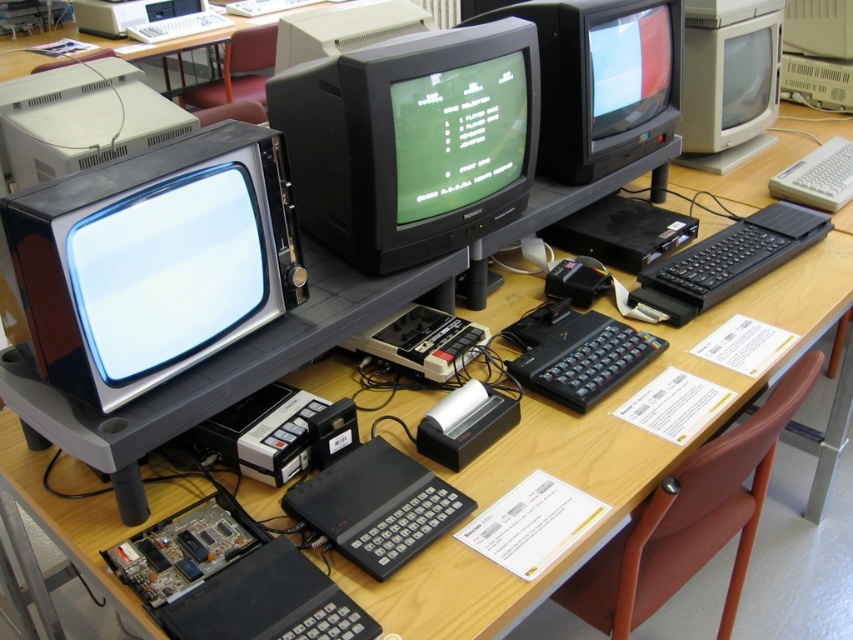
You are standing in front of the CRT monitors displayed on the table. There are two points marked on the table surface labeled as point (84, 204) and point (335, 241). Which point is closer to you?

Point (84, 204) is closer to the camera than point (335, 241), so the point closer to you is point (84, 204).

You are setting up a display and need to place a matte gray monitor at upper right and a white plastic keyboard at right. Given their sizes, which object should be placed first to ensure proper visibility?

The matte gray monitor at upper right should be placed first because it is taller than the white plastic keyboard at right, ensuring it doesn not block the keyboard when positioned.